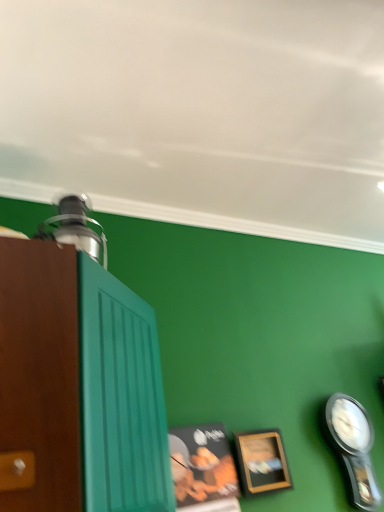
Question: Is there a large distance between wooden picture frame at lower center, the first picture frame in the left-to-right sequence, and black plastic clock at lower right?

Choices:
 (A) no
 (B) yes

Answer: (A)

Question: Can you see wooden picture frame at lower center, the 2th picture frame in the right-to-left sequence, touching black plastic clock at lower right?

Choices:
 (A) no
 (B) yes

Answer: (A)

Question: Does wooden picture frame at lower center, the 2th picture frame in the right-to-left sequence, have a smaller size compared to black plastic clock at lower right?

Choices:
 (A) yes
 (B) no

Answer: (A)

Question: Is wooden picture frame at lower center, the first picture frame in the left-to-right sequence, taller than black plastic clock at lower right?

Choices:
 (A) no
 (B) yes

Answer: (A)

Question: Is wooden picture frame at lower center, the first picture frame in the left-to-right sequence, positioned before black plastic clock at lower right?

Choices:
 (A) yes
 (B) no

Answer: (A)

Question: Based on their sizes in the image, would you say wooden picture frame at lower right, the first picture frame in the right-to-left sequence, is bigger or smaller than black plastic clock at lower right?

Choices:
 (A) big
 (B) small

Answer: (B)

Question: Looking at their shapes, would you say wooden picture frame at lower right, the first picture frame in the right-to-left sequence, is wider or thinner than black plastic clock at lower right?

Choices:
 (A) thin
 (B) wide

Answer: (A)

Question: From a real-world perspective, is wooden picture frame at lower right, the first picture frame in the right-to-left sequence, positioned above or below black plastic clock at lower right?

Choices:
 (A) above
 (B) below

Answer: (A)

Question: From the image's perspective, is wooden picture frame at lower right, positioned as the second picture frame in left-to-right order, above or below black plastic clock at lower right?

Choices:
 (A) above
 (B) below

Answer: (A)

Question: Considering the positions of wooden picture frame at lower center, the first picture frame in the left-to-right sequence, and black plastic clock at lower right in the image, is wooden picture frame at lower center, the first picture frame in the left-to-right sequence, taller or shorter than black plastic clock at lower right?

Choices:
 (A) short
 (B) tall

Answer: (A)

Question: Is point (192, 468) closer or farther from the camera than point (344, 459)?

Choices:
 (A) closer
 (B) farther

Answer: (A)

Question: Looking at their shapes, would you say wooden picture frame at lower center, the first picture frame in the left-to-right sequence, is wider or thinner than black plastic clock at lower right?

Choices:
 (A) thin
 (B) wide

Answer: (A)

Question: Would you say wooden picture frame at lower center, the 2th picture frame in the right-to-left sequence, is inside or outside black plastic clock at lower right?

Choices:
 (A) inside
 (B) outside

Answer: (B)

Question: Is wooden picture frame at lower center, the first picture frame in the left-to-right sequence, in front of or behind wooden picture frame at lower right, the first picture frame in the right-to-left sequence, in the image?

Choices:
 (A) front
 (B) behind

Answer: (A)

Question: Is wooden picture frame at lower center, the 2th picture frame in the right-to-left sequence, bigger or smaller than wooden picture frame at lower right, positioned as the second picture frame in left-to-right order?

Choices:
 (A) big
 (B) small

Answer: (A)